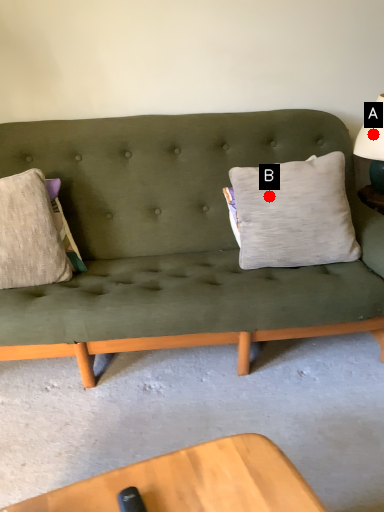
Question: Two points are circled on the image, labeled by A and B beside each circle. Among these points, which one is farthest from the camera?

Choices:
 (A) A is further
 (B) B is further

Answer: (A)